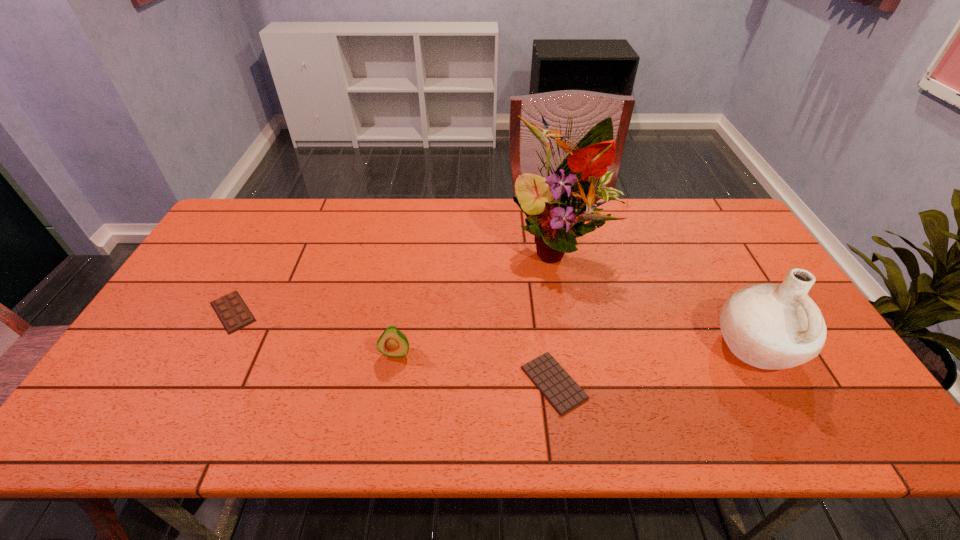
Image resolution: width=960 pixels, height=540 pixels. What are the coordinates of `object at the right edge` in the screenshot? It's located at (769, 326).

The height and width of the screenshot is (540, 960). What are the coordinates of `vacant space at the far edge` in the screenshot? It's located at (399, 225).

You are a GUI agent. You are given a task and a screenshot of the screen. Output one action in this format:
    pyautogui.click(x=<x>, y=<y>)
    Task: Click on the blank space at the near edge of the desktop
    
    Given the screenshot: What is the action you would take?
    pyautogui.click(x=563, y=425)

Where is `vacant space at the left edge of the desktop`? The width and height of the screenshot is (960, 540). vacant space at the left edge of the desktop is located at coordinates (130, 392).

Identify the location of blank space at the right edge of the desktop. (755, 251).

Locate an element on the screen. The image size is (960, 540). free spot between the pottery and the farthest object is located at coordinates (657, 295).

Locate an element on the screen. The width and height of the screenshot is (960, 540). free point between the second shortest object and the bouquet is located at coordinates (396, 279).

Find the location of a particular element. This screenshot has height=540, width=960. vacant area that lies between the taller chocolate bar and the pottery is located at coordinates (494, 329).

Locate an element on the screen. The height and width of the screenshot is (540, 960). empty location between the second tallest object and the avocado is located at coordinates (576, 349).

I want to click on vacant space that's between the shortest object and the third shortest object, so click(474, 368).